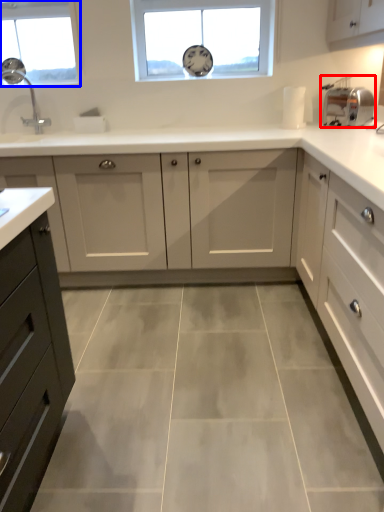
Question: Which object appears farthest to the camera in this image, appliance (highlighted by a red box) or window (highlighted by a blue box)?

Choices:
 (A) appliance
 (B) window

Answer: (B)